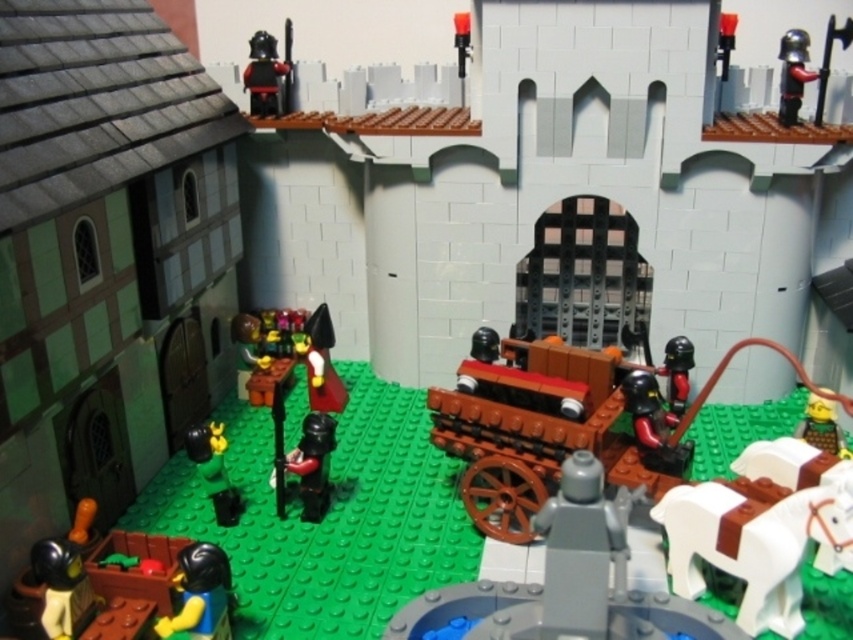
Question: Considering the relative positions of shiny black helmet at lower left and shiny black helmet at upper left in the image provided, where is shiny black helmet at lower left located with respect to shiny black helmet at upper left?

Choices:
 (A) below
 (B) above

Answer: (A)

Question: Which point appears closest to the camera in this image?

Choices:
 (A) (62, 586)
 (B) (666, 396)
 (C) (669, 540)
 (D) (639, 481)

Answer: (A)

Question: Where is shiny black helmet at lower left located in relation to shiny black helmet at lower right in the image?

Choices:
 (A) right
 (B) left

Answer: (B)

Question: Which point appears closest to the camera in this image?

Choices:
 (A) (213, 460)
 (B) (317, 490)
 (C) (740, 532)
 (D) (57, 554)

Answer: (D)

Question: Is white matte horse at lower right smaller than shiny black helmet at upper left?

Choices:
 (A) yes
 (B) no

Answer: (B)

Question: Which object is the farthest from the shiny black helmet at lower left?

Choices:
 (A) white matte horse at lower right
 (B) green matte figure at lower left
 (C) shiny silver helmet at upper right

Answer: (C)